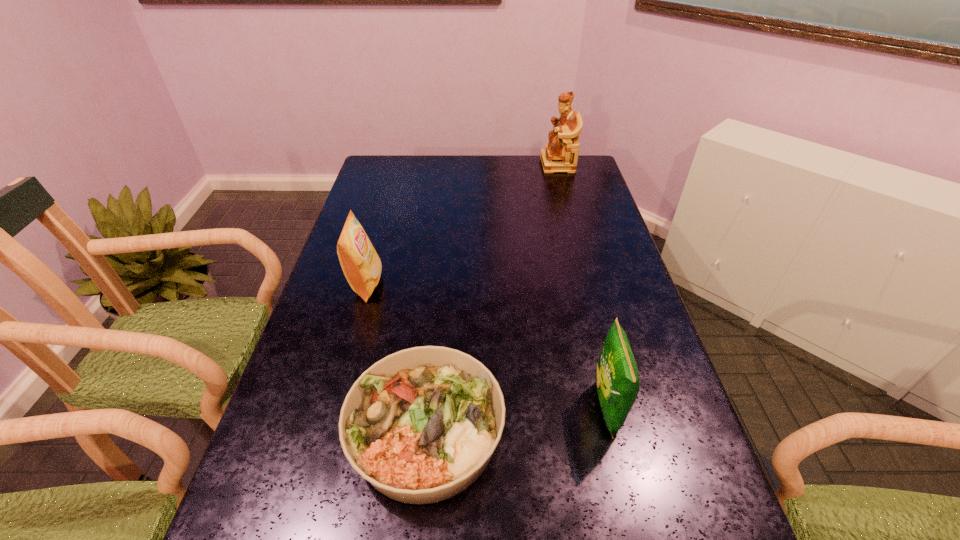
This screenshot has height=540, width=960. Identify the location of figurine. (561, 153).

Locate an element on the screen. the tallest object is located at coordinates (561, 153).

Image resolution: width=960 pixels, height=540 pixels. Identify the location of the right crisp (potato chip). (617, 379).

You are a GUI agent. You are given a task and a screenshot of the screen. Output one action in this format:
    pyautogui.click(x=<x>, y=<y>)
    Task: Click on the leftmost object
    This screenshot has height=540, width=960.
    Given the screenshot: What is the action you would take?
    pyautogui.click(x=361, y=265)

Where is `the farther crisp (potato chip)`? the farther crisp (potato chip) is located at coordinates (361, 265).

Image resolution: width=960 pixels, height=540 pixels. In order to click on salad plate in this screenshot , I will do `click(420, 425)`.

Where is `the third object from right to left`? The width and height of the screenshot is (960, 540). the third object from right to left is located at coordinates (420, 425).

At what (x,y) coordinates should I click in order to perform the action: click on vacant region located on the front-facing side of the farthest object. Please return your answer as a coordinate pair (x, y). Image resolution: width=960 pixels, height=540 pixels. Looking at the image, I should click on (467, 164).

Where is `free region located 0.120m on the front-facing side of the farthest object`? Image resolution: width=960 pixels, height=540 pixels. free region located 0.120m on the front-facing side of the farthest object is located at coordinates (512, 164).

Locate an element on the screen. This screenshot has width=960, height=540. blank area located on the front-facing side of the farthest object is located at coordinates (471, 164).